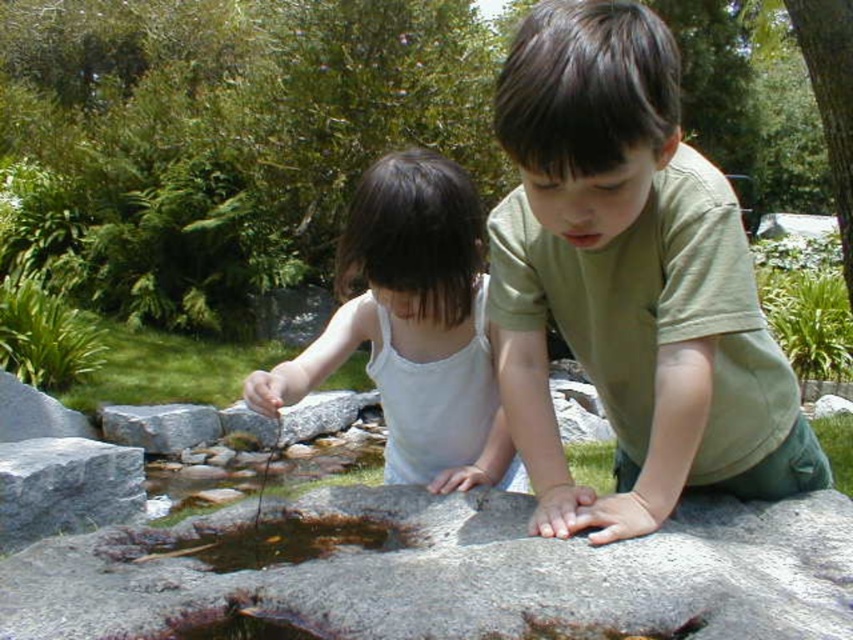
Consider the image. Based on the coordinates provided, which object is located at point [630,280] in the image?

The point [630,280] corresponds to the green cotton shirt at center.

You are standing at the edge of the water feature and want to place a small toy boat exactly at the point marked by the coordinates point (x=457, y=573). According to the scene, what object will the boat land on?

The boat will land on the gray smooth rock at center, as the coordinates point (x=457, y=573) corresponds to that object.